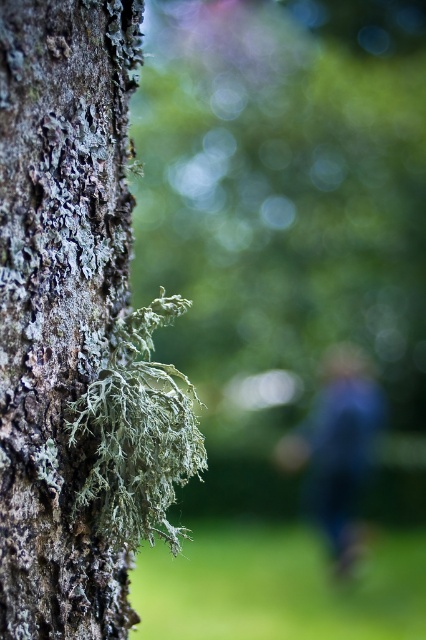
Question: Does green mossy bark at left have a larger size compared to blue fabric at center?

Choices:
 (A) no
 (B) yes

Answer: (A)

Question: Does green mossy bark at left appear under blue fabric at center?

Choices:
 (A) yes
 (B) no

Answer: (B)

Question: Does green mossy bark at left lie in front of blue fabric at center?

Choices:
 (A) no
 (B) yes

Answer: (B)